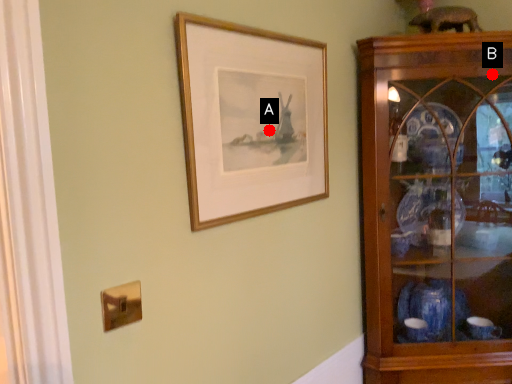
Question: Two points are circled on the image, labeled by A and B beside each circle. Among these points, which one is farthest from the camera?

Choices:
 (A) A is further
 (B) B is further

Answer: (B)